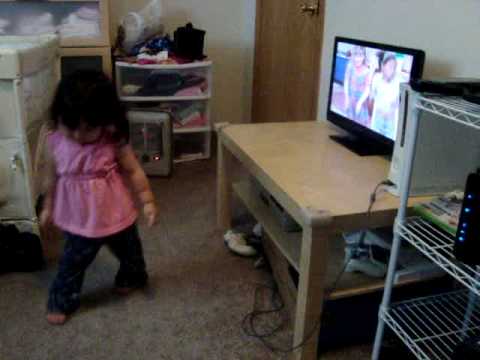
This screenshot has height=360, width=480. Find the location of `walls`. walls is located at coordinates (224, 39), (401, 35).